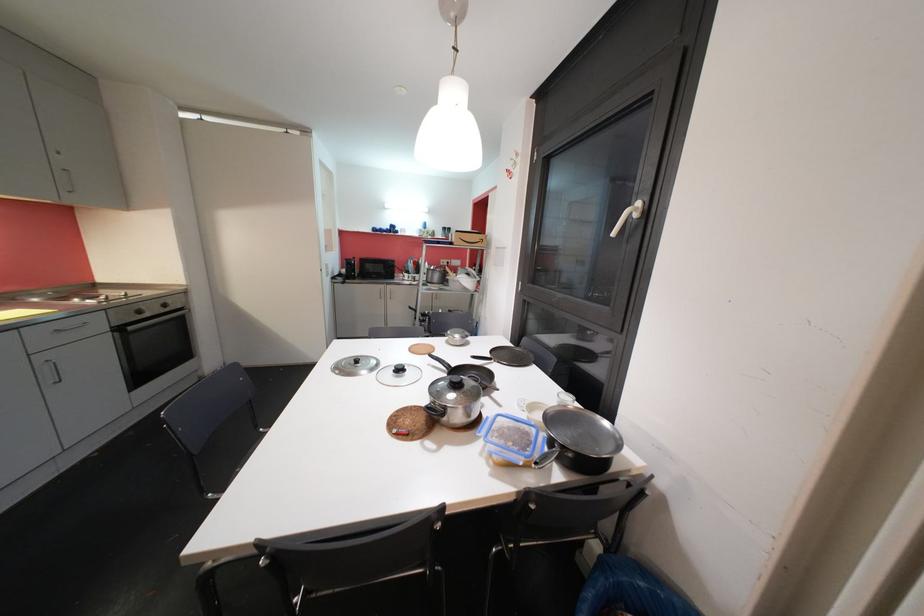
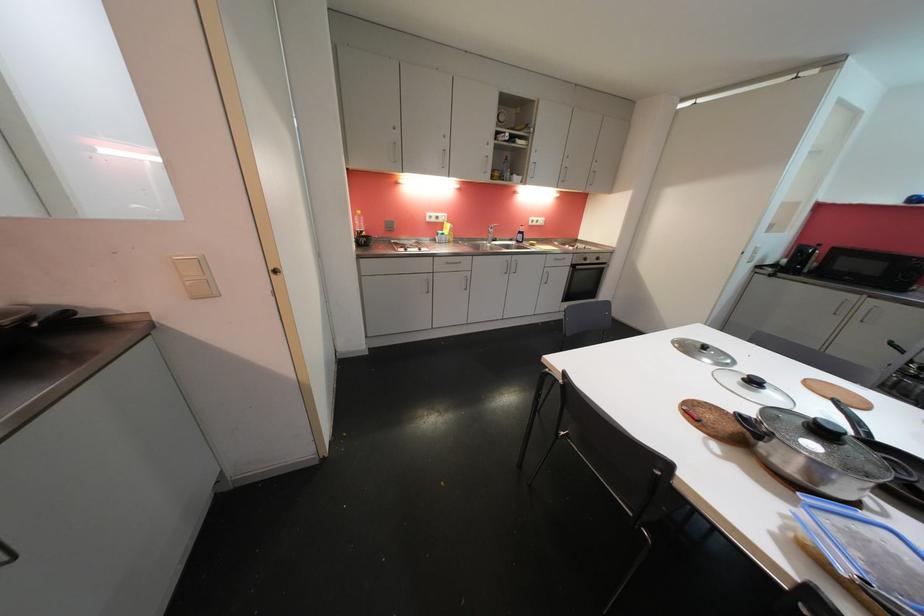
The point at (x=144, y=314) is marked in the first image. Where is the corresponding point in the second image?

(590, 262)